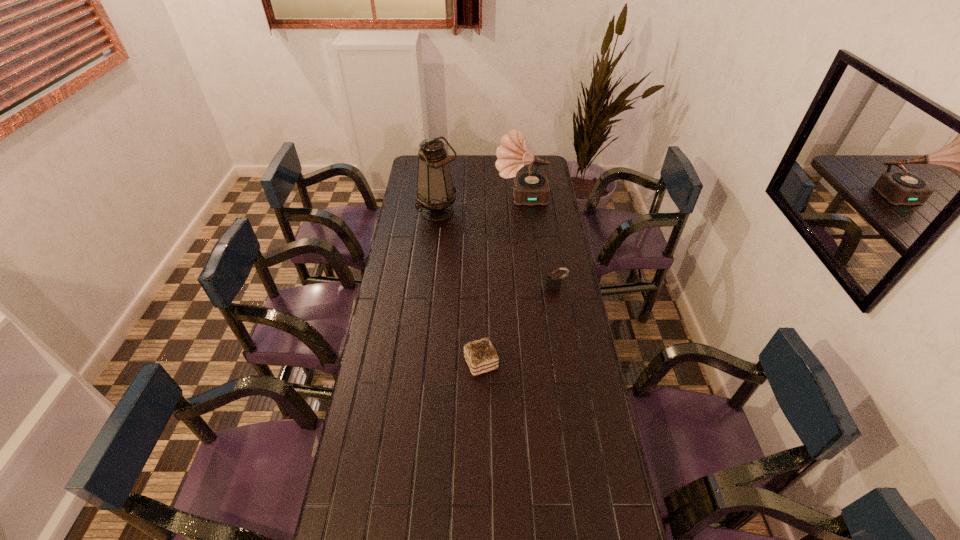
Locate an element on the screen. The width and height of the screenshot is (960, 540). oil lamp is located at coordinates (435, 195).

You are a GUI agent. You are given a task and a screenshot of the screen. Output one action in this format:
    pyautogui.click(x=<x>, y=<y>)
    Task: Click on the record player
    
    Given the screenshot: What is the action you would take?
    pyautogui.click(x=530, y=188)

This screenshot has height=540, width=960. I want to click on padlock, so click(553, 282).

At what (x,y) coordinates should I click in order to perform the action: click on the third farthest object. Please return your answer as a coordinate pair (x, y). This screenshot has width=960, height=540. Looking at the image, I should click on (553, 282).

This screenshot has height=540, width=960. I want to click on the nearest object, so click(x=481, y=356).

The width and height of the screenshot is (960, 540). I want to click on the third object from right to left, so click(x=481, y=356).

At what (x,y) coordinates should I click in order to perform the action: click on vacant space positioned on the right of the oil lamp. Please return your answer as a coordinate pair (x, y). The width and height of the screenshot is (960, 540). Looking at the image, I should click on (509, 212).

Find the location of a particular element. This screenshot has width=960, height=540. free space located from the horn of the record player is located at coordinates (473, 197).

You are a GUI agent. You are given a task and a screenshot of the screen. Output one action in this format:
    pyautogui.click(x=<x>, y=<y>)
    Task: Click on the vacant space located from the horn of the record player
    This screenshot has width=960, height=540.
    Given the screenshot: What is the action you would take?
    pyautogui.click(x=435, y=197)

Find the location of a particular element. The height and width of the screenshot is (540, 960). free point located 0.090m from the horn of the record player is located at coordinates (477, 197).